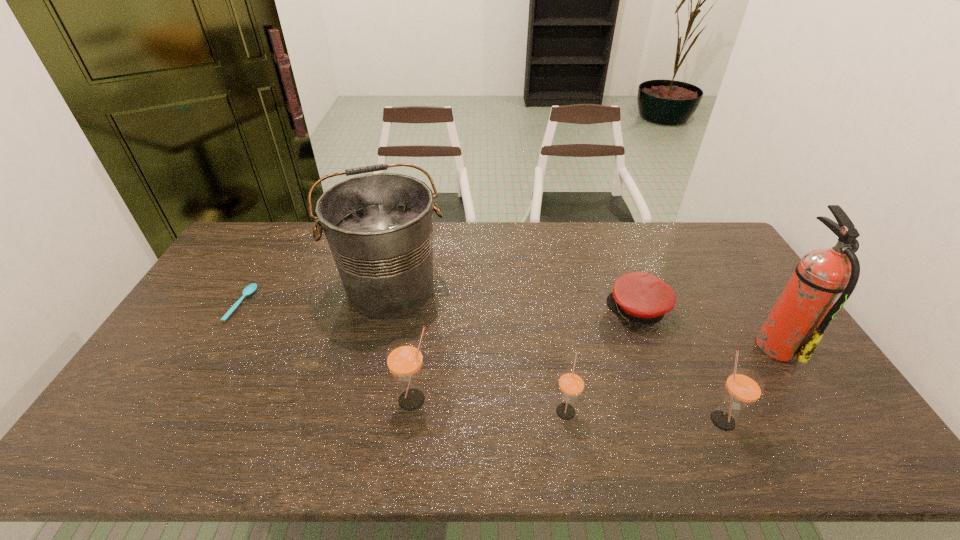
You are a GUI agent. You are given a task and a screenshot of the screen. Output one action in this format:
    pyautogui.click(x=<x>, y=<y>)
    Task: Click on the free point located on the left of the leftmost straw
    
    Given the screenshot: What is the action you would take?
    pyautogui.click(x=321, y=400)

The width and height of the screenshot is (960, 540). What are the coordinates of `free location located 0.360m on the left of the second straw from left to right` in the screenshot? It's located at (410, 410).

The height and width of the screenshot is (540, 960). Identify the location of vacant space positioned 0.220m on the back of the fourth tallest object. (686, 341).

Find the location of a particular element. The width and height of the screenshot is (960, 540). free point located on the left of the bucket is located at coordinates (234, 288).

At what (x,y) coordinates should I click in order to perform the action: click on vacant space located 0.240m at the front of the second shortest object where the visor is located. Please return your answer as a coordinate pair (x, y). This screenshot has width=960, height=540. Looking at the image, I should click on (532, 310).

I want to click on vacant space located 0.230m at the front of the second shortest object where the visor is located, so [x=535, y=310].

What are the coordinates of `vacant region located 0.350m at the front of the second shortest object where the visor is located` in the screenshot? It's located at (496, 310).

The image size is (960, 540). I want to click on free region located 0.270m on the back of the leftmost object, so click(x=280, y=238).

Locate an element on the screen. free spot located 0.330m at the nozzle of the fire extinguisher is located at coordinates (640, 345).

Locate an element on the screen. This screenshot has width=960, height=540. vacant region located at the nozzle of the fire extinguisher is located at coordinates 707,345.